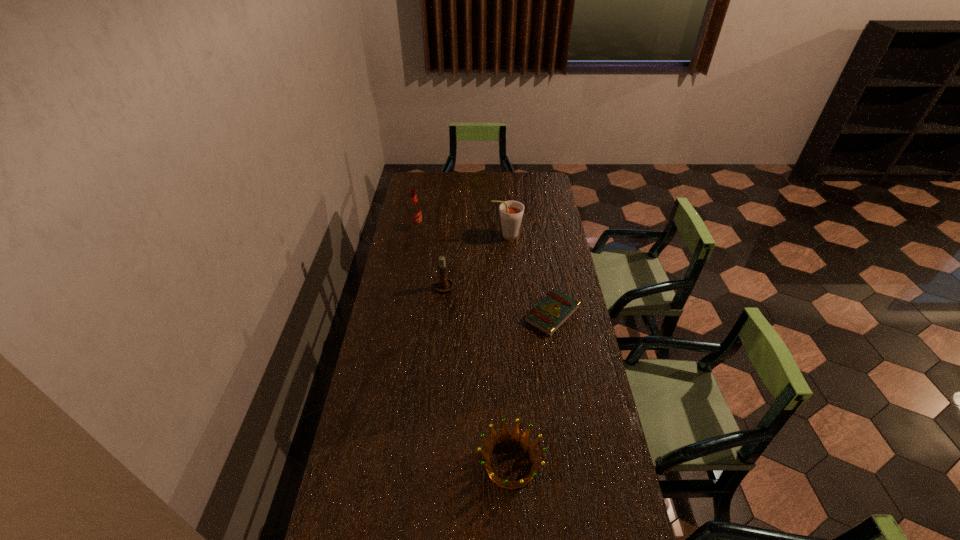
Where is `the right root beer`? Image resolution: width=960 pixels, height=540 pixels. the right root beer is located at coordinates (511, 212).

The width and height of the screenshot is (960, 540). Find the location of `the left root beer`. the left root beer is located at coordinates (415, 213).

This screenshot has height=540, width=960. Find the location of `candle holder`. candle holder is located at coordinates (443, 284).

At what (x,y) coordinates should I click in order to perform the action: click on the third shortest object. Please return your answer as a coordinate pair (x, y). The height and width of the screenshot is (540, 960). Looking at the image, I should click on (443, 284).

The height and width of the screenshot is (540, 960). Find the location of `crown`. crown is located at coordinates (505, 438).

Image resolution: width=960 pixels, height=540 pixels. In order to click on the fourth tallest object in this screenshot , I will do `click(505, 438)`.

Where is `the shortest object`? Image resolution: width=960 pixels, height=540 pixels. the shortest object is located at coordinates (548, 315).

I want to click on free location located 0.350m on the drink side of the right root beer, so click(x=419, y=236).

Identify the location of free point located 0.210m on the drink side of the right root beer. The image size is (960, 540). (447, 236).

Image resolution: width=960 pixels, height=540 pixels. I want to click on free point located on the drink side of the right root beer, so click(x=424, y=236).